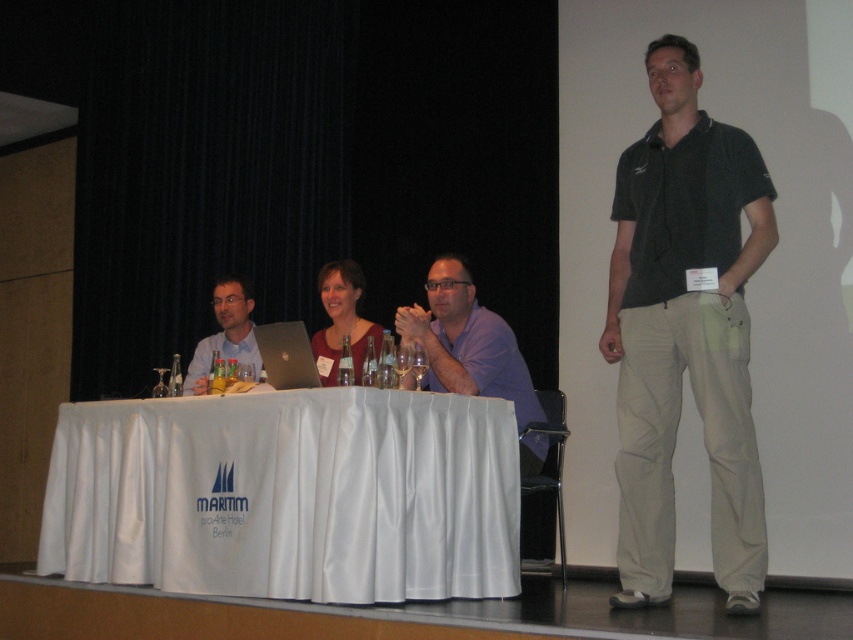
You are an event organizer who needs to place a 10 cm tall decorative vase on the table. Given the height difference between the white satin table at center and the silver metallic laptop at center, will the vase be visible over the laptop?

The white satin table at center has a greater height compared to the silver metallic laptop at center. Since the table is taller, placing the 10 cm tall decorative vase on it would allow it to be visible over the laptop.

You are an attendee at this event and want to place a name tag on the table. Which object, the white satin table at center or the matte black laptop at center, is closer to you so you can reach it easily?

The white satin table at center is closer to the viewer than the matte black laptop at center, so you can reach it easily.

You are an event organizer at the Maritim pro Arte Hotel Berlin. You need to place a new name tag on the table so that it is exactly where the point at coordinates point (466, 342) is located. Where should you place the new name tag on the table?

The point (466, 342) is located on the purple cotton shirt at center, so you should place the new name tag on the purple cotton shirt at center on the table.